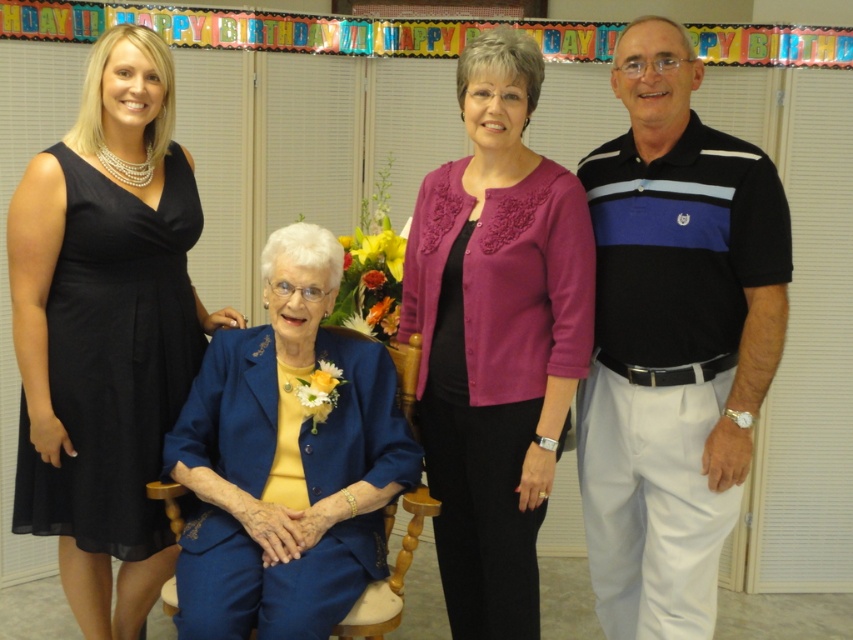
In the scene shown: You are standing in the room and want to take a photo of the seated elderly woman in the blue suit jacket. There are two people in the background at the coordinates point (x=699, y=253) and point (x=111, y=371). Which of these two people is blocking your view of the seated woman?

Point (x=699, y=253) is in front of point (x=111, y=371), so the person at point (x=699, y=253) is closer to you and would block your view of the seated elderly woman in the blue suit jacket.

You are organizing a clothing donation drive and need to determine which item takes up more space in a donation box. The items are the purple embroidered cardigan at center and the blue satin suit at center. Which item requires a larger donation box?

The blue satin suit at center requires a larger donation box because its width is greater than the purple embroidered cardigan at center.